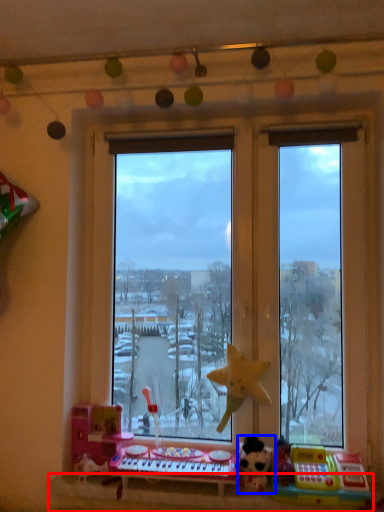
Question: Which object is further to the camera taking this photo, window sill (highlighted by a red box) or toy (highlighted by a blue box)?

Choices:
 (A) window sill
 (B) toy

Answer: (B)